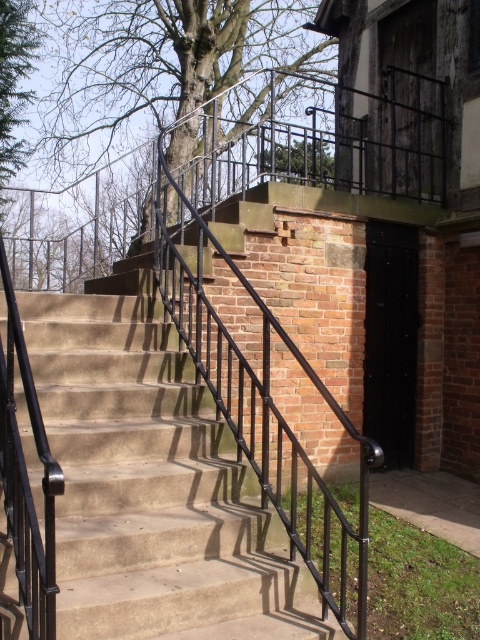
Question: Is concrete/steps at center to the right of green leafy tree at upper left from the viewer's perspective?

Choices:
 (A) no
 (B) yes

Answer: (B)

Question: Considering the relative positions of bare wood tree at upper center and green leafy tree at upper left in the image provided, where is bare wood tree at upper center located with respect to green leafy tree at upper left?

Choices:
 (A) below
 (B) above

Answer: (B)

Question: Which point appears closest to the camera in this image?

Choices:
 (A) (207, 40)
 (B) (19, 116)
 (C) (157, 340)

Answer: (C)

Question: Is concrete/steps at center smaller than green leafy tree at upper left?

Choices:
 (A) yes
 (B) no

Answer: (B)

Question: Which object is farther from the camera taking this photo?

Choices:
 (A) bare wood tree at upper center
 (B) green leafy tree at upper left
 (C) concrete/steps at center

Answer: (A)

Question: Which object appears farthest from the camera in this image?

Choices:
 (A) bare wood tree at upper center
 (B) concrete/steps at center
 (C) green leafy tree at upper left

Answer: (A)